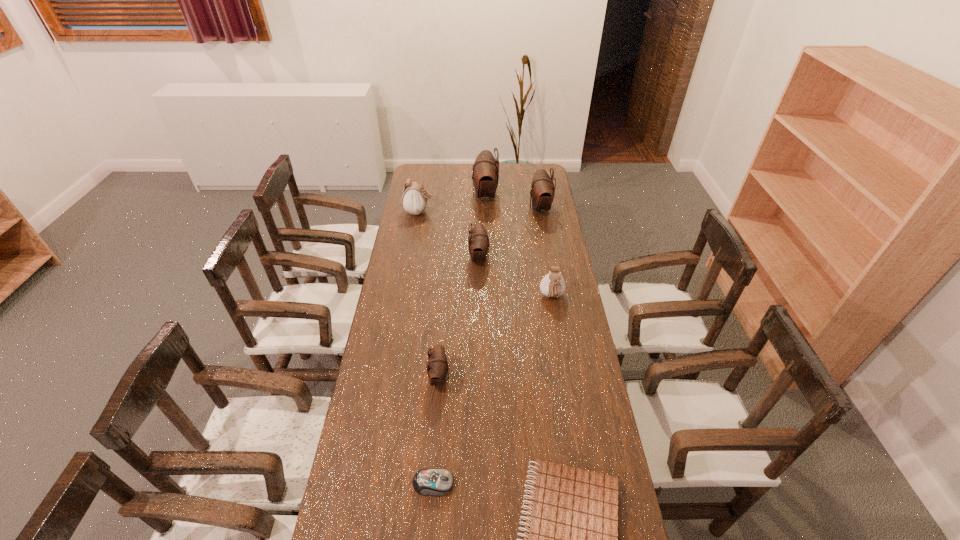
Point out which brown pouch is positioned as the nearest to the right white pouch. Please provide its 2D coordinates. Your answer should be formatted as a tuple, i.e. [(x, y)], where the tuple contains the x and y coordinates of a point satisfying the conditions above.

[(478, 241)]